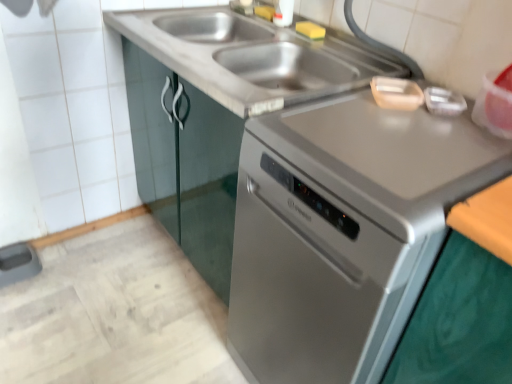
Locate an element on the screen. vacant area on top of satin silver dishwasher at center (from a real-world perspective) is located at coordinates click(x=407, y=129).